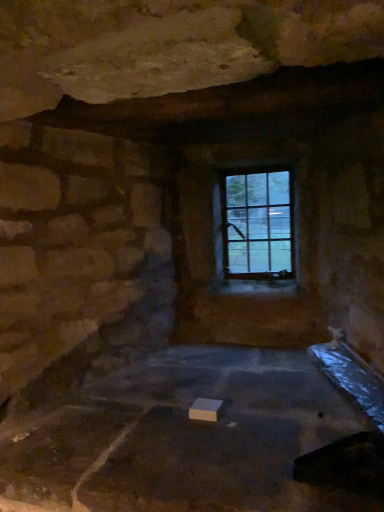
Locate an element on the screen. This screenshot has width=384, height=512. white matte block at center is located at coordinates (184, 438).

The image size is (384, 512). Describe the element at coordinates (184, 438) in the screenshot. I see `white matte block at center` at that location.

Measure the distance between white matte block at center and camera.

white matte block at center is 32.95 inches away from camera.

What do you see at coordinates (257, 223) in the screenshot? This screenshot has width=384, height=512. I see `clear glass window at upper center` at bounding box center [257, 223].

The image size is (384, 512). Find the location of `clear glass window at upper center`. clear glass window at upper center is located at coordinates (257, 223).

Find the location of a particular element. This screenshot has height=512, width=384. white matte block at center is located at coordinates (184, 438).

Considering the positions of objects white matte block at center and clear glass window at upper center in the image provided, who is more to the right, white matte block at center or clear glass window at upper center?

Positioned to the right is clear glass window at upper center.

In the scene shown: Which is behind, white matte block at center or clear glass window at upper center?

clear glass window at upper center is further from the camera.

Is point (35, 484) closer or farther from the camera than point (238, 278)?

Clearly, point (35, 484) is closer to the camera than point (238, 278).

From the image's perspective, relative to clear glass window at upper center, is white matte block at center above or below?

Based on their image positions, white matte block at center is located beneath clear glass window at upper center.

From a real-world perspective, which object stands above the other?

clear glass window at upper center is physically above.

Which of these two, white matte block at center or clear glass window at upper center, is wider?

With larger width is white matte block at center.

Can you confirm if white matte block at center is shorter than clear glass window at upper center?

Yes, white matte block at center is shorter than clear glass window at upper center.

Is white matte block at center bigger than clear glass window at upper center?

Correct, white matte block at center is larger in size than clear glass window at upper center.

Is clear glass window at upper center a part of white matte block at center?

Definitely not — clear glass window at upper center is not inside white matte block at center.

Would you say white matte block at center is a long distance from clear glass window at upper center?

No.

Is clear glass window at upper center at the back of white matte block at center?

That's not correct — white matte block at center is not looking away from clear glass window at upper center.

At what (x,y) coordinates should I click in order to perform the action: click on foundation beneath the clear glass window at upper center (from a real-world perspective). Please return your answer as a coordinate pair (x, y). The image size is (384, 512). Looking at the image, I should click on (184, 438).

Considering the relative positions of clear glass window at upper center and white matte block at center in the image provided, is clear glass window at upper center to the left of white matte block at center from the viewer's perspective?

In fact, clear glass window at upper center is to the right of white matte block at center.

Considering the relative positions of clear glass window at upper center and white matte block at center in the image provided, is clear glass window at upper center behind white matte block at center?

That is True.

Is point (281, 229) more distant than point (121, 473)?

That is True.

From the image's perspective, is clear glass window at upper center beneath white matte block at center?

No, from the image's perspective, clear glass window at upper center is not below white matte block at center.

From a real-world perspective, is clear glass window at upper center located beneath white matte block at center?

Incorrect, from a real-world perspective, clear glass window at upper center is higher than white matte block at center.

Is clear glass window at upper center wider than white matte block at center?

In fact, clear glass window at upper center might be narrower than white matte block at center.

Does clear glass window at upper center have a greater height compared to white matte block at center?

Correct, clear glass window at upper center is much taller as white matte block at center.

Between clear glass window at upper center and white matte block at center, which one has larger size?

white matte block at center.

Is clear glass window at upper center spatially inside white matte block at center, or outside of it?

clear glass window at upper center is not inside white matte block at center, it's outside.

Is clear glass window at upper center next to white matte block at center?

No, clear glass window at upper center is not beside white matte block at center.

Could you tell me if clear glass window at upper center is facing white matte block at center?

Yes, clear glass window at upper center is turned towards white matte block at center.

What's the angular difference between clear glass window at upper center and white matte block at center's facing directions?

The angle between the facing direction of clear glass window at upper center and the facing direction of white matte block at center is 0.00104 degrees.

Identify the location of foundation below the clear glass window at upper center (from the image's perspective). (184, 438).

At what (x,y) coordinates should I click in order to perform the action: click on foundation on the left of clear glass window at upper center. Please return your answer as a coordinate pair (x, y). This screenshot has width=384, height=512. Looking at the image, I should click on (184, 438).

Identify the location of window located behind the white matte block at center. Image resolution: width=384 pixels, height=512 pixels. (257, 223).